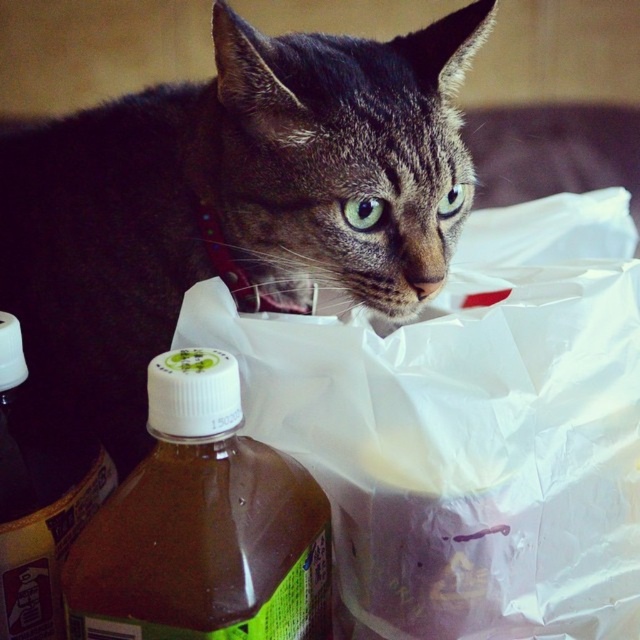
You are organizing items on a shelf and need to place the brown translucent bottle at lower left and the brown matte bottle at lower left. Since they are both at the lower left, how can you tell which one is closer to you?

The brown translucent bottle at lower left is closer because it is in front of the brown matte bottle at lower left.

In the scene shown: You are organizing items on a kitchen counter and see the white plastic bag at center and the brown matte bottle at lower left. Which item is located to the right of the other?

The white plastic bag at center is positioned on the right side of brown matte bottle at lower left.